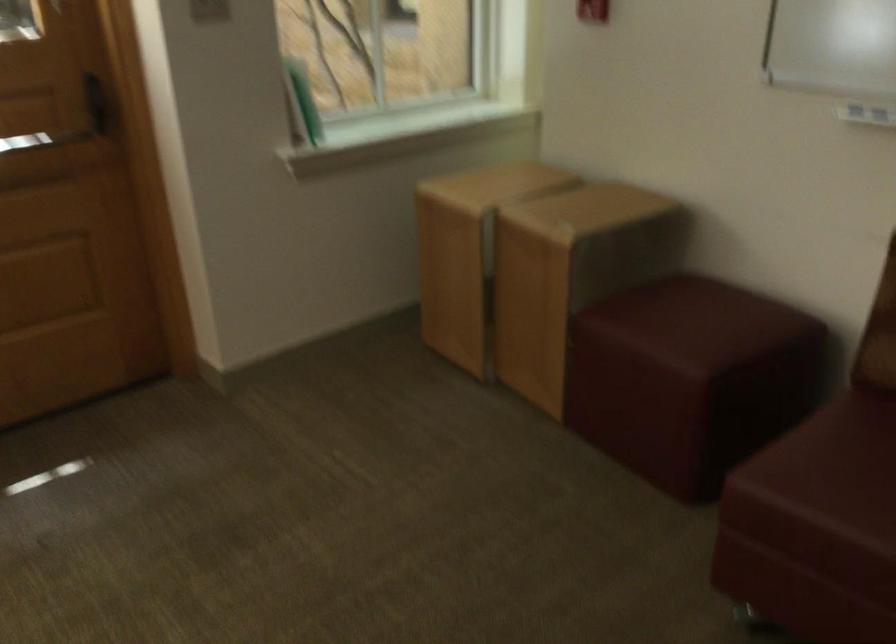
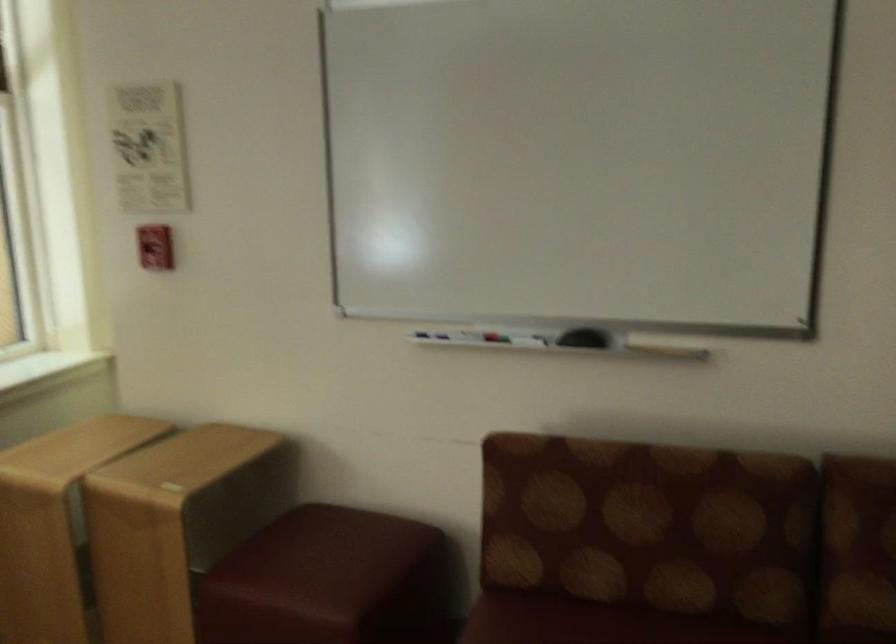
Question: The camera is either moving clockwise (left) or counter-clockwise (right) around the object. The first image is from the beginning of the video and the second image is from the end. Is the camera moving left or right when shooting the video?

Choices:
 (A) Left
 (B) Right

Answer: (A)